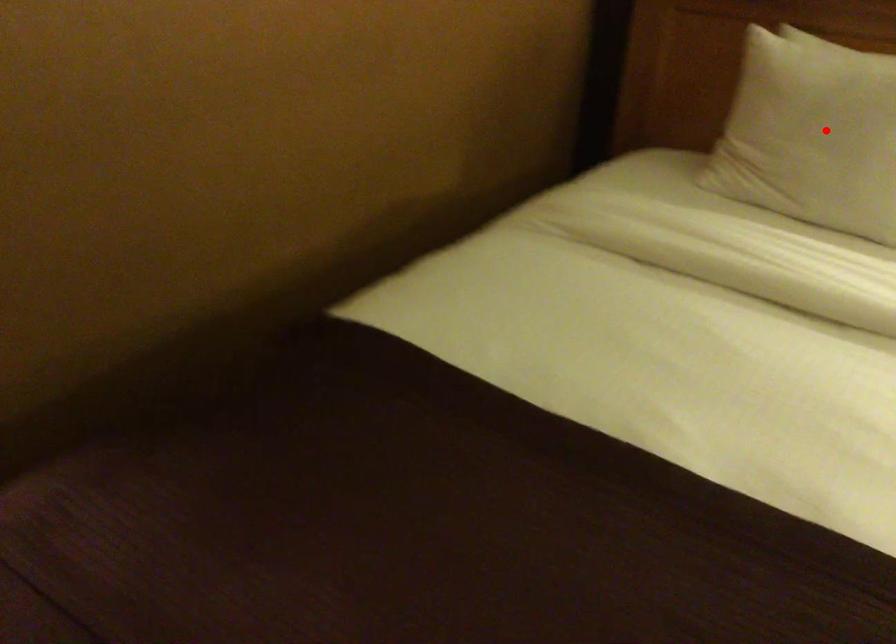
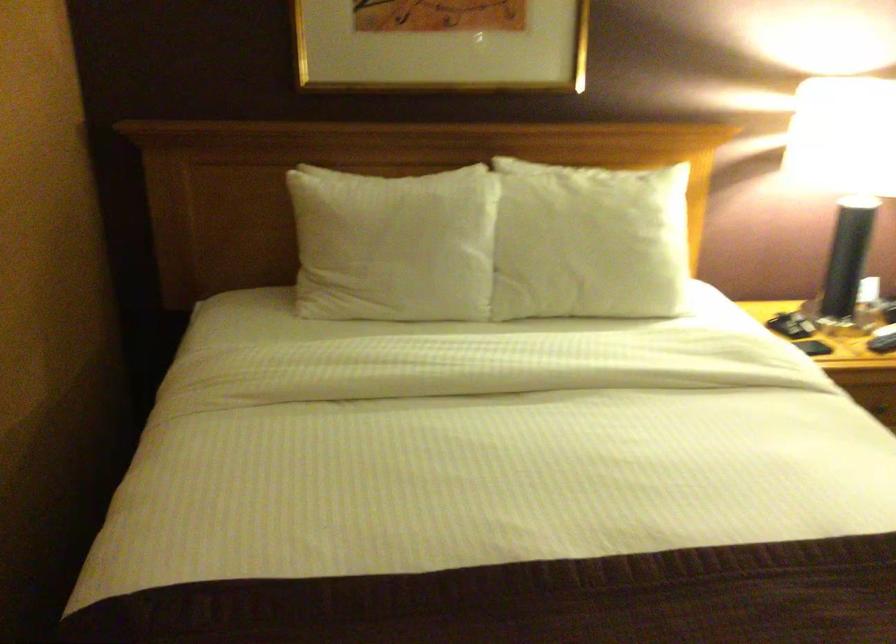
Find the pixel in the second image that matches the highlighted location in the first image.

(393, 245)